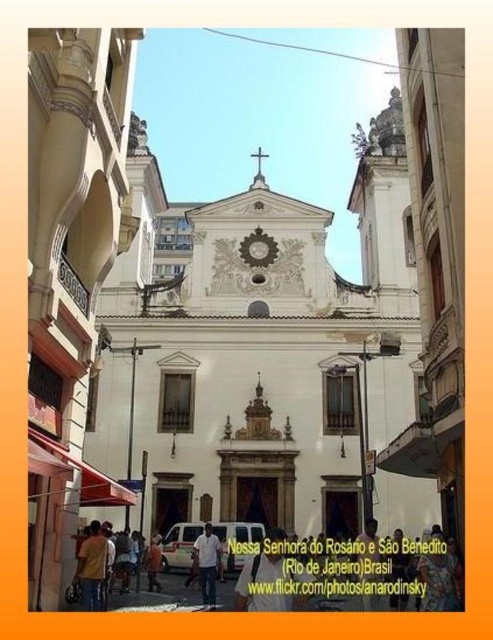
You are a photographer standing in front of the historic church in Rio de Janeiro. You notice both the white marble church at center and the white matte shirt at center in your viewfinder. Which object should you zoom in on to capture more details of the larger one?

The white marble church at center is larger in size than the white matte shirt at center, so you should zoom in on the white marble church at center to capture more details of the larger one.

You are standing in front of the historic church in Rio de Janeiro. If you were to draw a straight line from your current position to the white stone church at center, what coordinates would the line end at?

The line would end at the coordinates point (69, 266) where the white stone church at center is located.